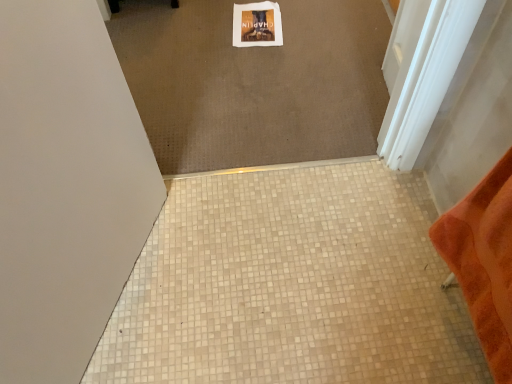
Measure the distance between white mosaic tile at center and camera.

They are 3.40 feet apart.

Describe the element at coordinates (291, 286) in the screenshot. I see `white mosaic tile at center` at that location.

You are a GUI agent. You are given a task and a screenshot of the screen. Output one action in this format:
    pyautogui.click(x=<x>, y=<y>)
    Task: Click on the white mosaic tile at center
    This screenshot has height=384, width=512.
    Given the screenshot: What is the action you would take?
    pos(291,286)

Describe the element at coordinates (404, 64) in the screenshot. I see `white glossy screen door at upper right` at that location.

Locate an element on the screen. The height and width of the screenshot is (384, 512). white glossy screen door at upper right is located at coordinates (404, 64).

The height and width of the screenshot is (384, 512). I want to click on white mosaic tile at center, so click(x=291, y=286).

Considering the relative positions of white glossy screen door at upper right and white mosaic tile at center in the image provided, is white glossy screen door at upper right to the right of white mosaic tile at center from the viewer's perspective?

Yes, white glossy screen door at upper right is to the right of white mosaic tile at center.

Which is behind, white glossy screen door at upper right or white mosaic tile at center?

white glossy screen door at upper right is behind.

Is point (393, 49) closer or farther from the camera than point (381, 328)?

Point (393, 49) is positioned farther from the camera compared to point (381, 328).

From the image's perspective, is white glossy screen door at upper right on white mosaic tile at center?

Yes, from the image's perspective, white glossy screen door at upper right is over white mosaic tile at center.

From a real-world perspective, is white glossy screen door at upper right physically above white mosaic tile at center?

Yes.

In terms of width, does white glossy screen door at upper right look wider or thinner when compared to white mosaic tile at center?

Clearly, white glossy screen door at upper right has less width compared to white mosaic tile at center.

In terms of height, does white glossy screen door at upper right look taller or shorter compared to white mosaic tile at center?

In the image, white glossy screen door at upper right appears to be taller than white mosaic tile at center.

Does white glossy screen door at upper right have a larger size compared to white mosaic tile at center?

No, white glossy screen door at upper right is not bigger than white mosaic tile at center.

Is white glossy screen door at upper right completely or partially outside of white mosaic tile at center?

Yes.

Is white glossy screen door at upper right placed right next to white mosaic tile at center?

white glossy screen door at upper right is not next to white mosaic tile at center, and they're not touching.

Is white glossy screen door at upper right turned away from white mosaic tile at center?

No, white glossy screen door at upper right is not facing away from white mosaic tile at center.

What's the angular difference between white glossy screen door at upper right and white mosaic tile at center's facing directions?

The facing directions of white glossy screen door at upper right and white mosaic tile at center are 91 degrees apart.

How much distance is there between white glossy screen door at upper right and white mosaic tile at center?

A distance of 19.96 inches exists between white glossy screen door at upper right and white mosaic tile at center.

At what (x,y) coordinates should I click in order to perform the action: click on screen door behind the white mosaic tile at center. Please return your answer as a coordinate pair (x, y). The image size is (512, 384). Looking at the image, I should click on (404, 64).

Which is more to the left, white mosaic tile at center or white glossy screen door at upper right?

Positioned to the left is white mosaic tile at center.

Which object is further away from the camera taking this photo, white mosaic tile at center or white glossy screen door at upper right?

white glossy screen door at upper right is further away from the camera.

From the picture: Which point is more distant from viewer, (168, 269) or (421, 6)?

The point (168, 269) is farther.

From the image's perspective, is white mosaic tile at center below white glossy screen door at upper right?

Yes, from the image's perspective, white mosaic tile at center is below white glossy screen door at upper right.

From a real-world perspective, who is located higher, white mosaic tile at center or white glossy screen door at upper right?

From a 3D spatial view, white glossy screen door at upper right is above.

Which object is thinner, white mosaic tile at center or white glossy screen door at upper right?

white glossy screen door at upper right.

From their relative heights in the image, would you say white mosaic tile at center is taller or shorter than white glossy screen door at upper right?

Considering their sizes, white mosaic tile at center has less height than white glossy screen door at upper right.

Between white mosaic tile at center and white glossy screen door at upper right, which one has smaller size?

With smaller size is white glossy screen door at upper right.

Is white mosaic tile at center outside of white glossy screen door at upper right?

Absolutely, white mosaic tile at center is external to white glossy screen door at upper right.

Consider the image. Are white mosaic tile at center and white glossy screen door at upper right located far from each other?

Actually, white mosaic tile at center and white glossy screen door at upper right are a little close together.

Is white mosaic tile at center oriented towards white glossy screen door at upper right?

No, white mosaic tile at center is not oriented towards white glossy screen door at upper right.

How different are the orientations of white mosaic tile at center and white glossy screen door at upper right in degrees?

91 degrees.

This screenshot has height=384, width=512. Find the location of `tile below the white glossy screen door at upper right (from the image's perspective)`. tile below the white glossy screen door at upper right (from the image's perspective) is located at coordinates (291, 286).

Where is `tile on the left of white glossy screen door at upper right`? Image resolution: width=512 pixels, height=384 pixels. tile on the left of white glossy screen door at upper right is located at coordinates (291, 286).

Where is `screen door above the white mosaic tile at center (from a real-world perspective)`? The image size is (512, 384). screen door above the white mosaic tile at center (from a real-world perspective) is located at coordinates (404, 64).